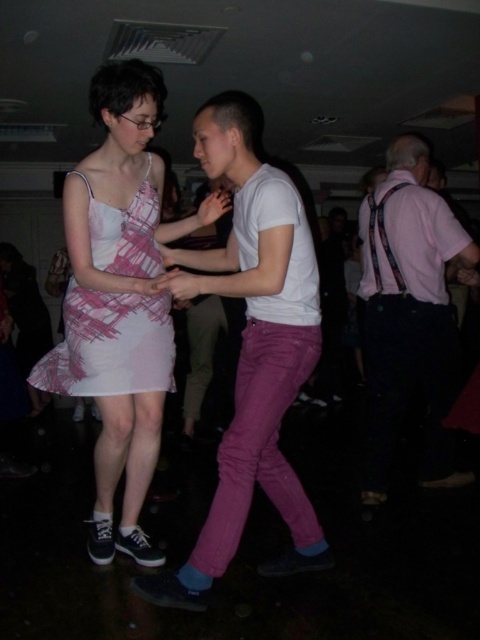
Question: Which of these objects is positioned closest to the pink fabric shirt at right?

Choices:
 (A) purple cotton pants at center
 (B) pink fabric dress at center

Answer: (A)

Question: Which of these objects is positioned farthest from the pink fabric dress at center?

Choices:
 (A) pink fabric shirt at right
 (B) purple cotton pants at center
 (C) pink printed fabric dress at center

Answer: (A)

Question: Which of the following is the closest to the observer?

Choices:
 (A) (405, 205)
 (B) (108, 556)

Answer: (B)

Question: Is pink fabric shirt at right above pink printed fabric dress at center?

Choices:
 (A) yes
 (B) no

Answer: (B)

Question: Is pink fabric dress at center above pink printed fabric dress at center?

Choices:
 (A) yes
 (B) no

Answer: (B)

Question: Is purple cotton pants at center to the left of pink printed fabric dress at center from the viewer's perspective?

Choices:
 (A) no
 (B) yes

Answer: (A)